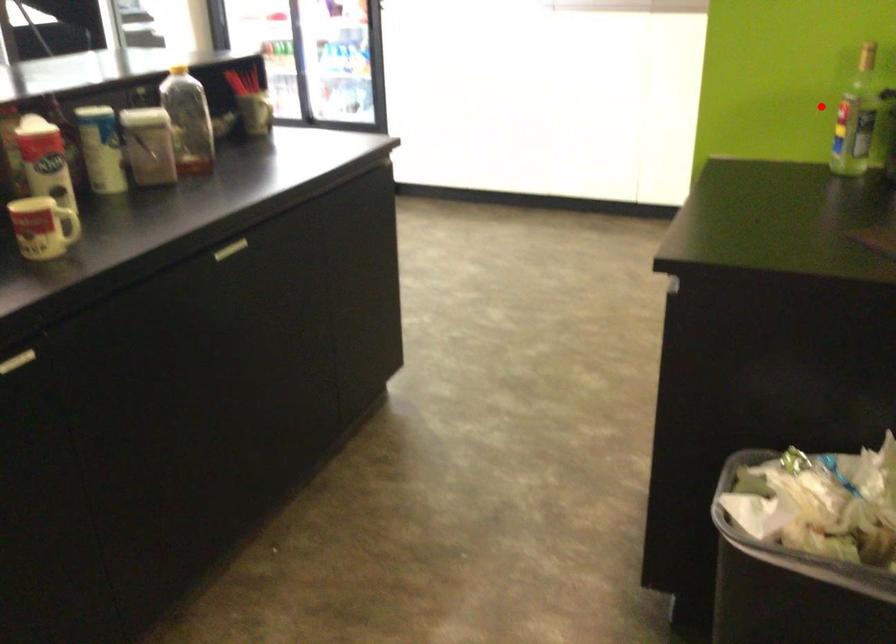
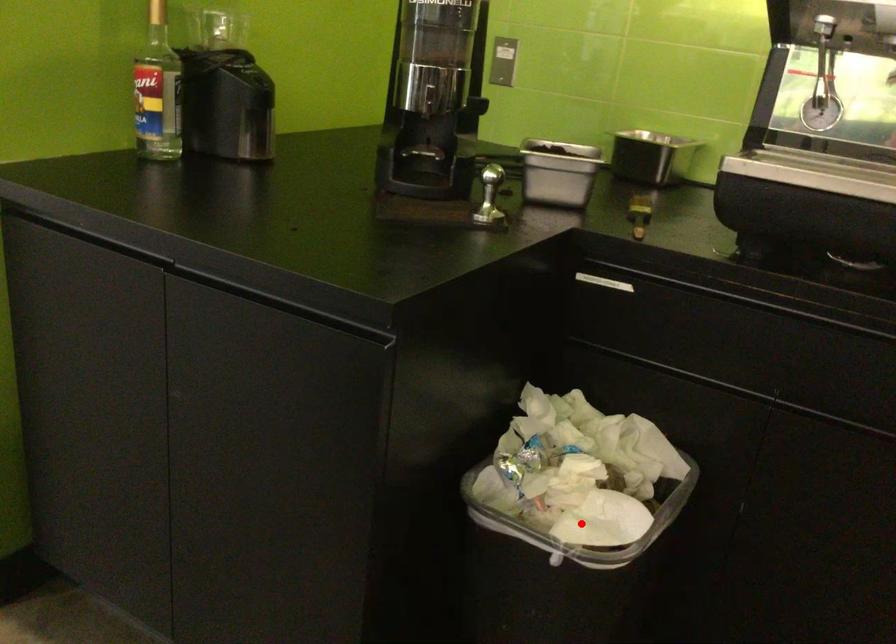
I am providing you with two images of the same scene from different viewpoints. A red point is marked on the first image and another point is marked on the second image. Does the point marked in image1 correspond to the same location as the one in image2?

No